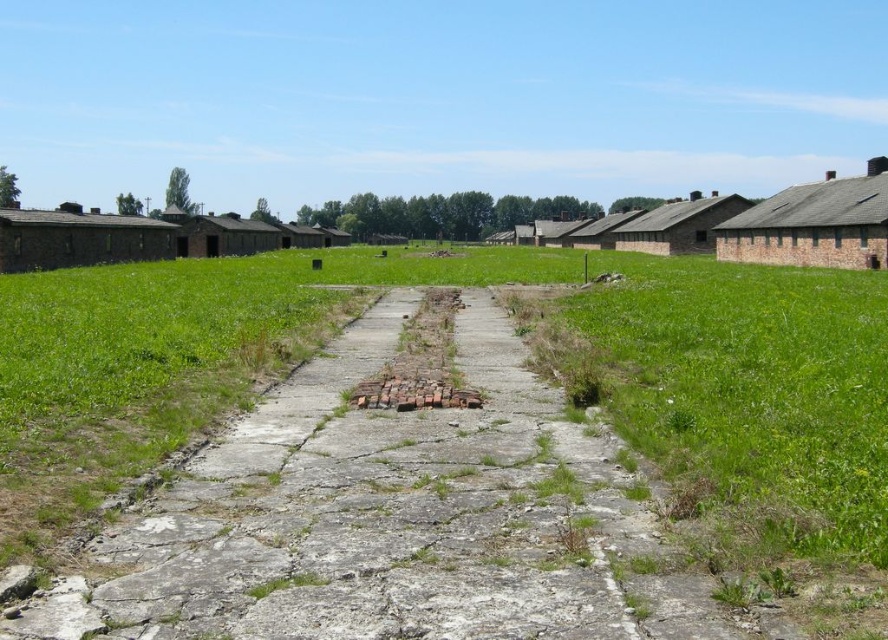
You are standing on the cracked concrete pathway and want to walk towards the brown brick hut at upper right and the brown brick hut at left. Which one will you reach first?

You will reach the brown brick hut at upper right first because it is closer to the viewer than the brown brick hut at left.

You are a tour guide leading a group through the historical site. You notice two brown brick huts in the scene. Which one has a wider structure, the brown brick hut at right or the brown brick hut at center?

The brown brick hut at right has a wider structure than the brown brick hut at center.